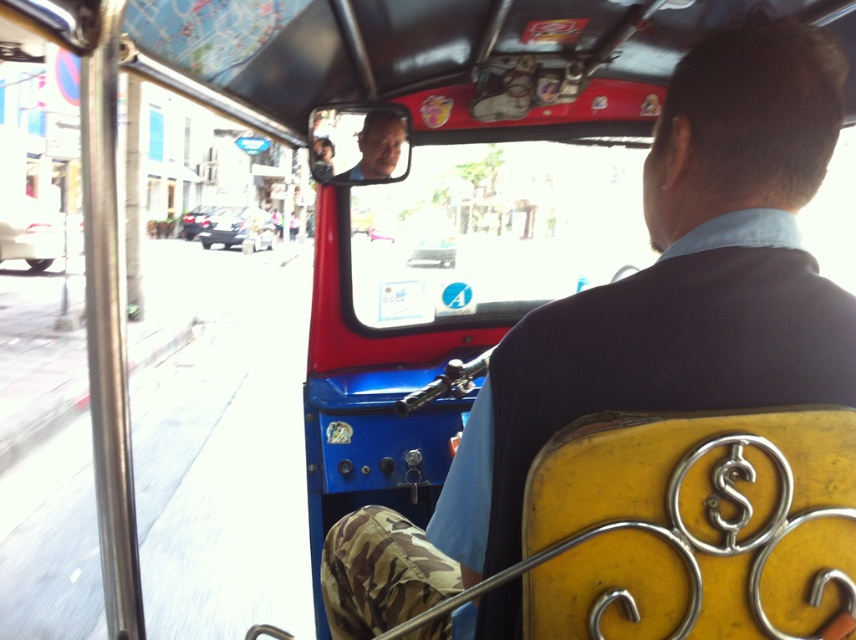
Question: Is matte black face at center smaller than metallic silver car at left?

Choices:
 (A) no
 (B) yes

Answer: (B)

Question: Based on their relative distances, which object is nearer to the matte black vest at center?

Choices:
 (A) matte black face at center
 (B) metallic silver car at left

Answer: (A)

Question: Which point appears farthest from the camera in this image?

Choices:
 (A) (708, 108)
 (B) (224, 208)
 (C) (367, 154)

Answer: (B)

Question: Which of these objects is positioned farthest from the matte black vest at center?

Choices:
 (A) metallic silver car at left
 (B) matte black face at center

Answer: (A)

Question: From the image, what is the correct spatial relationship of matte black vest at center in relation to matte black face at center?

Choices:
 (A) right
 (B) left

Answer: (A)

Question: Is matte black face at center smaller than metallic silver car at left?

Choices:
 (A) no
 (B) yes

Answer: (B)